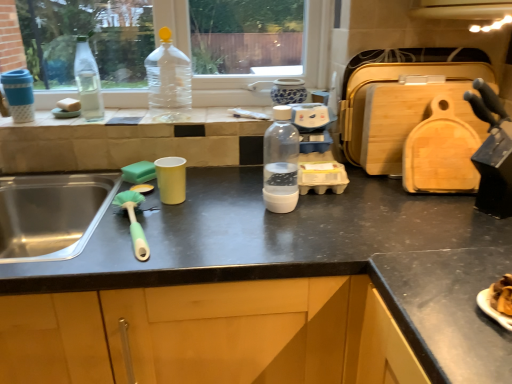
This screenshot has width=512, height=384. In order to click on vacant area on the back side of clear glass bottle at left, which is the third bottle from right to left in this screenshot , I will do `click(114, 112)`.